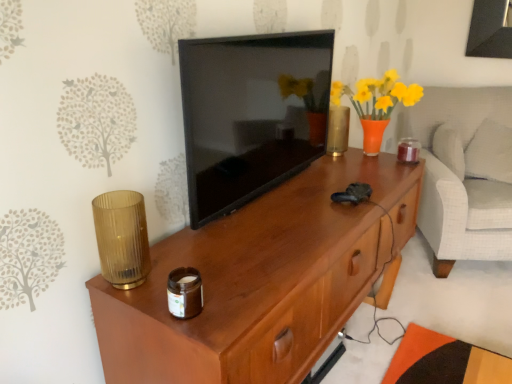
I want to click on free spot in front of brown glass jar at lower center, which is the 1th candle holder from front to back, so click(194, 330).